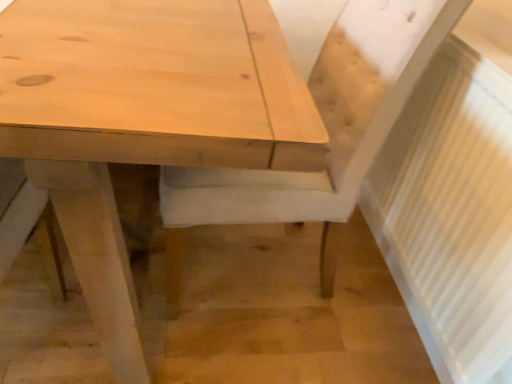
Question: Considering the relative sizes of white textured radiator at right and natural wood chair at center in the image provided, is white textured radiator at right smaller than natural wood chair at center?

Choices:
 (A) yes
 (B) no

Answer: (A)

Question: Does white textured radiator at right come in front of natural wood chair at center?

Choices:
 (A) no
 (B) yes

Answer: (B)

Question: From the image's perspective, is white textured radiator at right located above natural wood chair at center?

Choices:
 (A) no
 (B) yes

Answer: (A)

Question: Is white textured radiator at right not within natural wood chair at center?

Choices:
 (A) yes
 (B) no

Answer: (A)

Question: Does white textured radiator at right appear on the left side of natural wood chair at center?

Choices:
 (A) no
 (B) yes

Answer: (A)

Question: Can you confirm if white textured radiator at right is bigger than natural wood chair at center?

Choices:
 (A) no
 (B) yes

Answer: (A)

Question: Is natural wood table at center wider than white textured radiator at right?

Choices:
 (A) yes
 (B) no

Answer: (A)

Question: Is natural wood table at center aimed at white textured radiator at right?

Choices:
 (A) no
 (B) yes

Answer: (A)

Question: Is natural wood table at center positioned with its back to white textured radiator at right?

Choices:
 (A) no
 (B) yes

Answer: (A)

Question: Does natural wood table at center have a lesser width compared to white textured radiator at right?

Choices:
 (A) yes
 (B) no

Answer: (B)

Question: Considering the relative sizes of natural wood table at center and white textured radiator at right in the image provided, is natural wood table at center smaller than white textured radiator at right?

Choices:
 (A) yes
 (B) no

Answer: (B)

Question: Considering the relative sizes of natural wood table at center and white textured radiator at right in the image provided, is natural wood table at center bigger than white textured radiator at right?

Choices:
 (A) yes
 (B) no

Answer: (A)

Question: Could you tell me if natural wood chair at center is facing natural wood table at center?

Choices:
 (A) no
 (B) yes

Answer: (B)